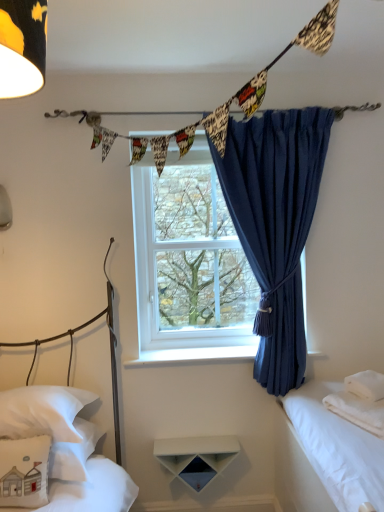
Find the location of a particular element. This screenshot has width=384, height=512. blank space situated above white smooth window sill at center (from a real-world perspective) is located at coordinates 206,350.